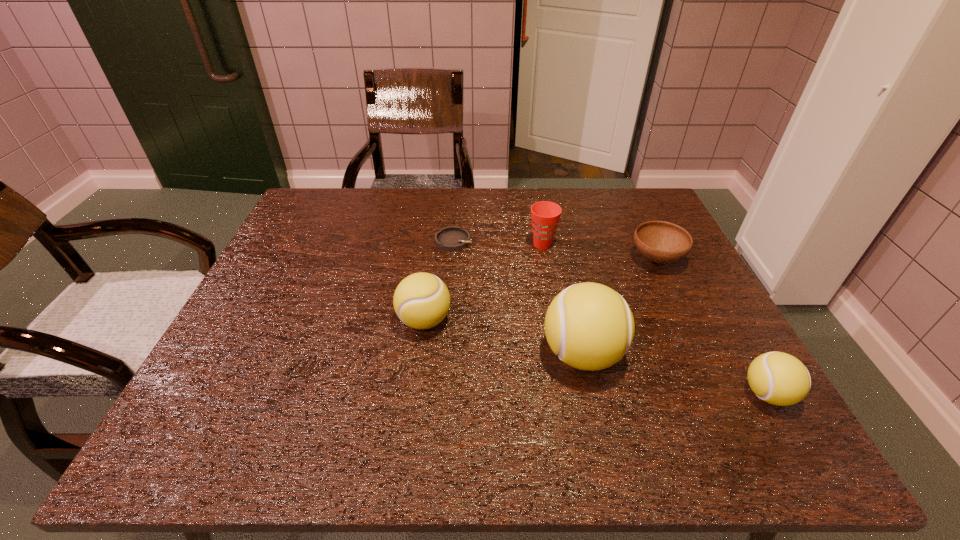
Find the location of a particular element. The image size is (960, 540). vacant space at the right edge of the desktop is located at coordinates [x=643, y=295].

Image resolution: width=960 pixels, height=540 pixels. In the image, there is a desktop. In order to click on vacant space at the far left corner in this screenshot , I will do `click(324, 201)`.

You are a GUI agent. You are given a task and a screenshot of the screen. Output one action in this format:
    pyautogui.click(x=<x>, y=<y>)
    Task: Click on the free point at the near right corner
    This screenshot has height=540, width=960.
    Given the screenshot: What is the action you would take?
    coord(720,402)

Locate an element on the screen. This screenshot has width=960, height=540. free space that is in between the bowl and the second shortest tennis ball is located at coordinates (540, 290).

The image size is (960, 540). Find the location of `empty location between the bowl and the rightmost tennis ball`. empty location between the bowl and the rightmost tennis ball is located at coordinates pyautogui.click(x=711, y=327).

This screenshot has width=960, height=540. I want to click on vacant area that lies between the cup and the shortest object, so click(498, 243).

Identify the location of empty location between the ashtray and the cup. (498, 243).

This screenshot has width=960, height=540. What are the coordinates of `vacant area that lies between the cup and the leftmost tennis ball` in the screenshot? It's located at (483, 282).

Locate an element on the screen. free space between the cup and the fourth tallest object is located at coordinates (655, 319).

Identify the location of unoccupied position between the cup and the second tallest tennis ball. The image size is (960, 540). (483, 282).